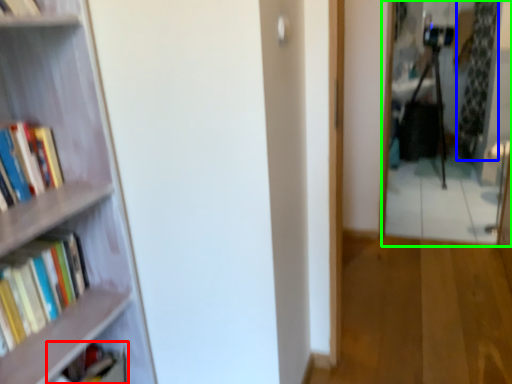
Question: Which object is positioned closest to book (highlighted by a red box)? Select from curtain (highlighted by a blue box) and mirror (highlighted by a green box).

Choices:
 (A) curtain
 (B) mirror

Answer: (B)